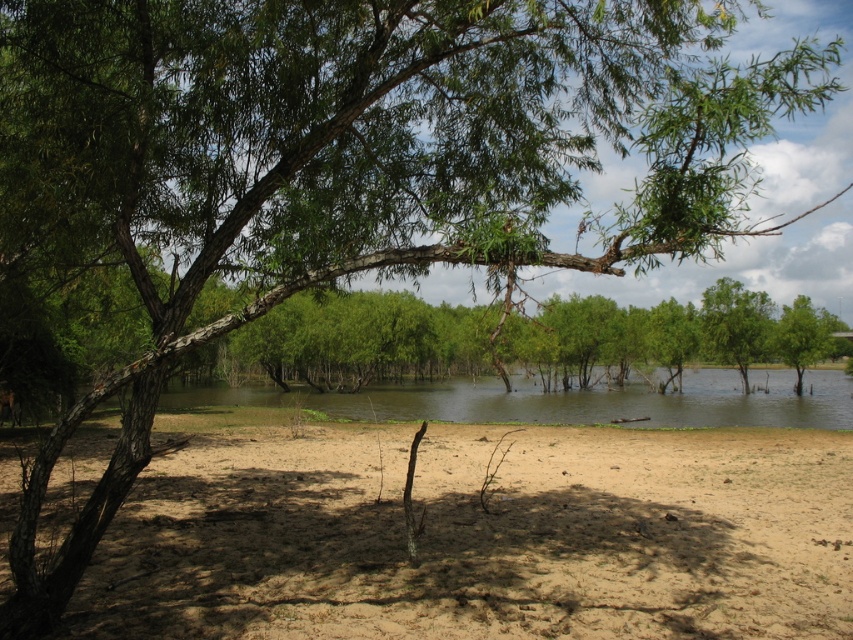
You are standing on the brown sandy dirt at lower center and want to reach the clear water at center. Which direction should you move to get there?

You should move to the right because the brown sandy dirt at lower center is to the left of clear water at center.

From the picture: You are standing at point A with coordinates point A at (641, 484). You want to walk to point B which is 11.14 meters away. Is there a clear path between you and point B, considering the sandy area and submerged trees?

The points are 11.14 meters apart, but the presence of submerged trees in the middle ground may obstruct the path. Check for any submerged trees between the two points before proceeding.